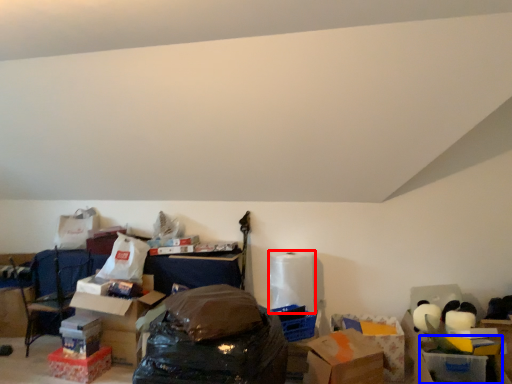
Question: Which of the following is the farthest to the observer, toilet paper (highlighted by a red box) or storage box (highlighted by a blue box)?

Choices:
 (A) toilet paper
 (B) storage box

Answer: (A)